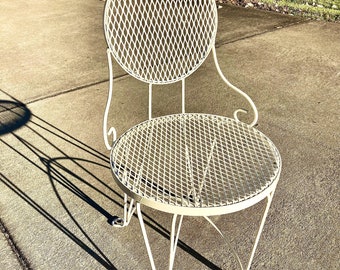
This screenshot has height=270, width=340. I want to click on chair's shadow going to the top left, so click(14, 121).